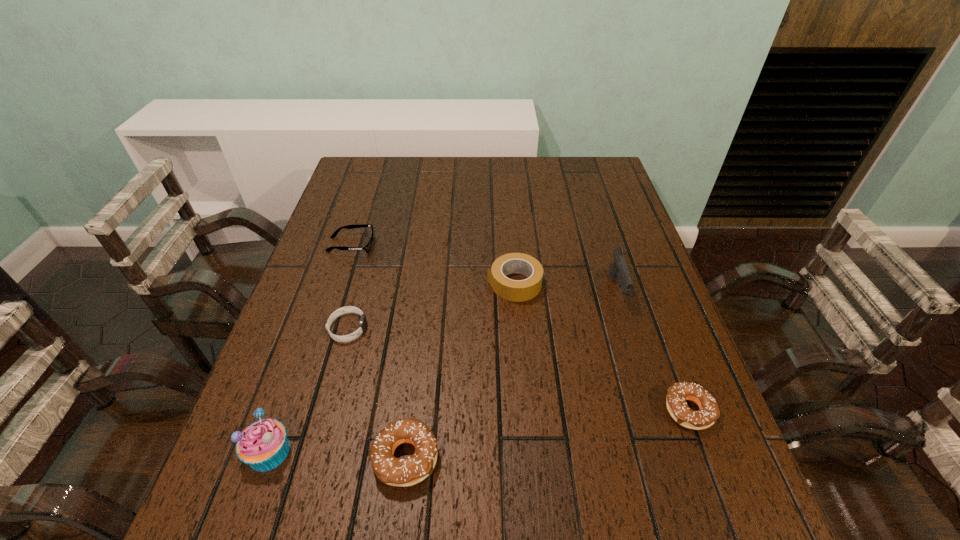
Where is `vacant area at the far left corner of the desktop`? This screenshot has width=960, height=540. vacant area at the far left corner of the desktop is located at coordinates (353, 170).

Identify the location of free space between the shorter doughnut and the fifth object from left to right. Image resolution: width=960 pixels, height=540 pixels. (602, 347).

Find the location of `vacant point located between the third object from right to left and the muffin`. vacant point located between the third object from right to left and the muffin is located at coordinates (392, 368).

Identify the location of empty location between the pistol and the rightmost object. (653, 350).

In order to click on vacant space that's between the taller doughnut and the wristband in this screenshot , I will do `click(376, 393)`.

Identify the location of vacant point located between the third object from right to left and the third shortest object. The height and width of the screenshot is (540, 960). (602, 347).

The height and width of the screenshot is (540, 960). What are the coordinates of `vacant area that lies between the right doughnut and the pistol` in the screenshot? It's located at (653, 350).

The height and width of the screenshot is (540, 960). I want to click on free space between the pistol and the duct tape, so click(565, 287).

Locate an element on the screen. The height and width of the screenshot is (540, 960). free space between the sunglasses and the muffin is located at coordinates (310, 348).

The height and width of the screenshot is (540, 960). Identify the location of free space between the wristband and the fifth object from left to right. (431, 306).